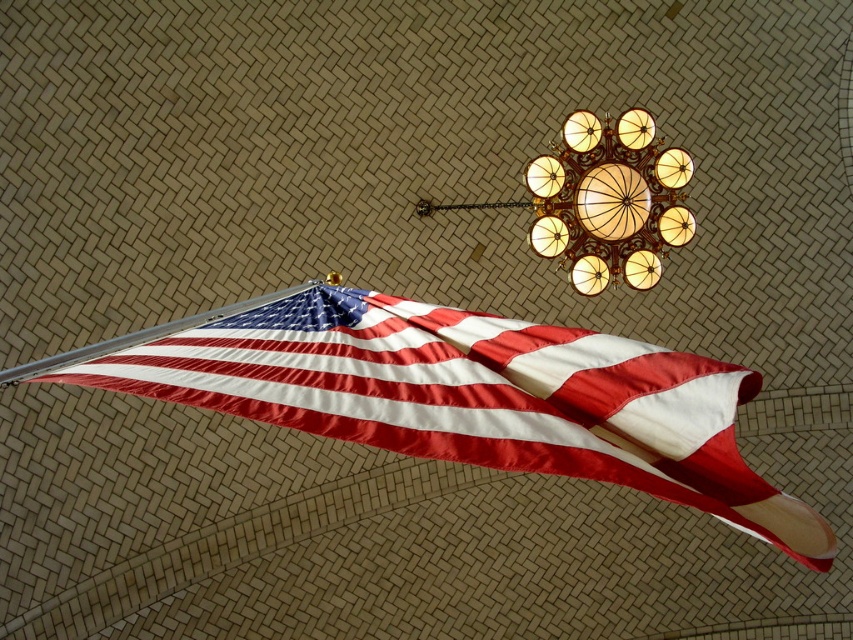
You are an interior designer planning to hang a new painting. You see the point at coordinates point [608,200]. Where exactly is this point located?

The point at coordinates point [608,200] is located on the matte gold chandelier at upper center.

From the picture: You are an interior designer working on a project where the silky fabric flag at lower left and the matte gold chandelier at upper center need to be spaced exactly 7 meters apart. Based on the image provided, will the current placement meet the client requirement?

The silky fabric flag at lower left is 7.19 meters from the matte gold chandelier at upper center, which is 0.19 meters over the required 7 meters. Therefore, the current placement does not meet the client requirement.

You are standing in front of a brick wall with a flag and a chandelier. You want to touch the silky fabric flag at lower left. Which direction should you move from the point marked by the coordinates point (476, 397)?

The point (476, 397) already marks the silky fabric flag at lower left, so you are already at the correct position to touch it.